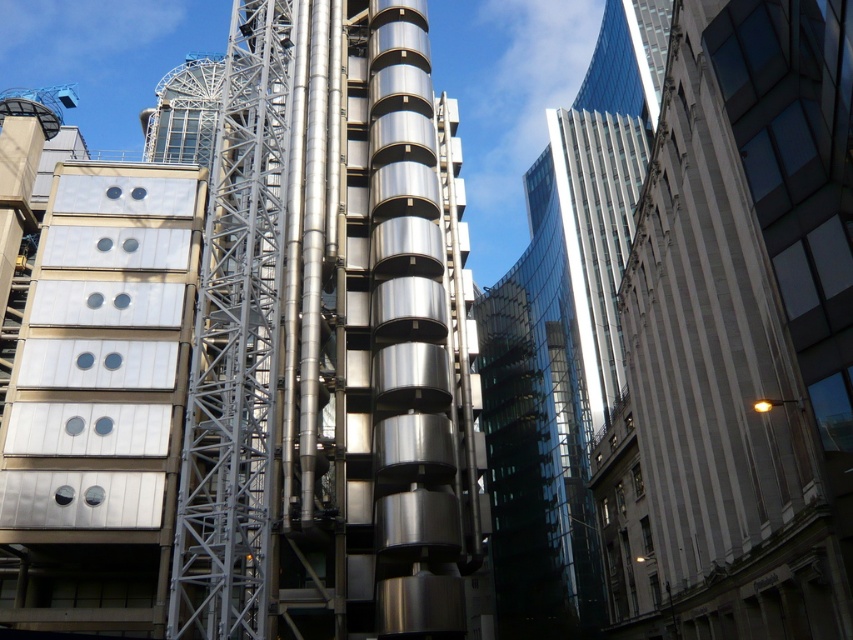
You are an architect observing the scene. You need to determine which building is closer to you. Which one is closer between the white glossy building at right and the glassy reflective skyscraper at upper right?

The white glossy building at right is closer to you as it is positioned in front of the glassy reflective skyscraper at upper right.

From the picture: You are an architect standing in front of the metallic silver tower at center and the white glossy building at right. Which building would appear closer to you?

The metallic silver tower at center appears closer to you because it is positioned further to the viewer than the white glossy building at right.